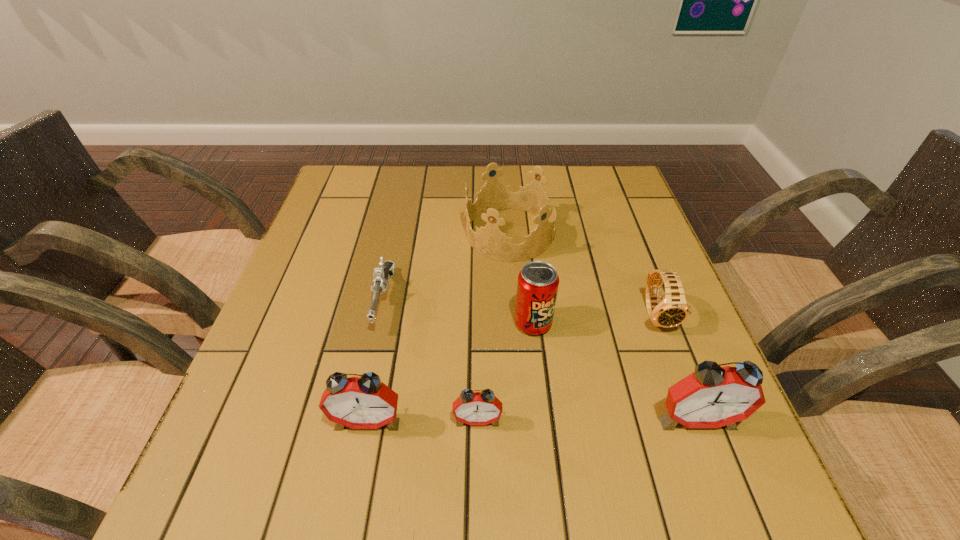
I want to click on empty location between the farthest object and the gun, so click(x=446, y=267).

The height and width of the screenshot is (540, 960). I want to click on empty space that is in between the rightmost alarm clock and the second alarm clock from left to right, so (x=587, y=420).

I want to click on free space that is in between the tiara and the second alarm clock from left to right, so click(493, 327).

Where is `object that is the fourth closest to the watch`? This screenshot has height=540, width=960. object that is the fourth closest to the watch is located at coordinates (472, 408).

Choose which object is the third nearest neighbor to the gun. Please provide its 2D coordinates. Your answer should be formatted as a tuple, i.e. [(x, y)], where the tuple contains the x and y coordinates of a point satisfying the conditions above.

[(472, 408)]

Where is `alarm clock that stands as the second closest to the rightmost alarm clock`? alarm clock that stands as the second closest to the rightmost alarm clock is located at coordinates (364, 402).

This screenshot has height=540, width=960. Find the location of `alarm clock that is the second nearest to the second shortest alarm clock`. alarm clock that is the second nearest to the second shortest alarm clock is located at coordinates (713, 396).

At what (x,y) coordinates should I click in order to perform the action: click on free space in the image that satisfies the following two spatial constraints: 1. on the front-facing side of the tiara; 2. on the clock face of the second shortest alarm clock. Please return your answer as a coordinate pair (x, y). The image size is (960, 540). Looking at the image, I should click on (525, 421).

Identify the location of vacant area that satisfies the following two spatial constraints: 1. on the front-facing side of the farthest object; 2. aimed along the barrel of the gun. This screenshot has height=540, width=960. click(x=516, y=300).

At what (x,y) coordinates should I click in order to perform the action: click on free space that satisfies the following two spatial constraints: 1. aimed along the barrel of the gun; 2. on the right side of the soda can. Please return your answer as a coordinate pair (x, y). The image size is (960, 540). Looking at the image, I should click on (378, 323).